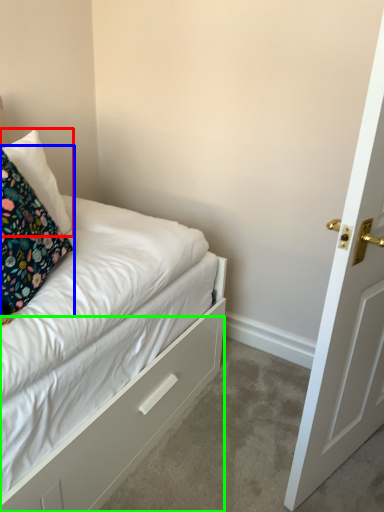
Question: Which is farther away from pillow (highlighted by a red box)? pillow (highlighted by a blue box) or drawer (highlighted by a green box)?

Choices:
 (A) pillow
 (B) drawer

Answer: (B)